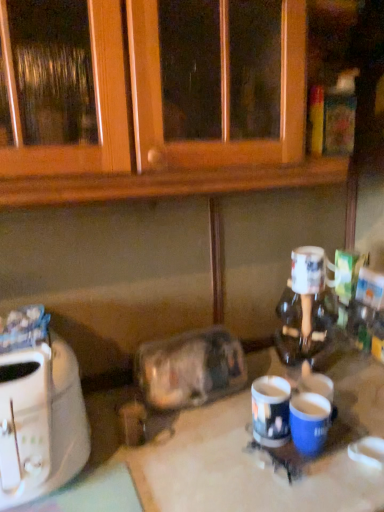
I want to click on free space above white glossy table at center (from a real-world perspective), so click(225, 441).